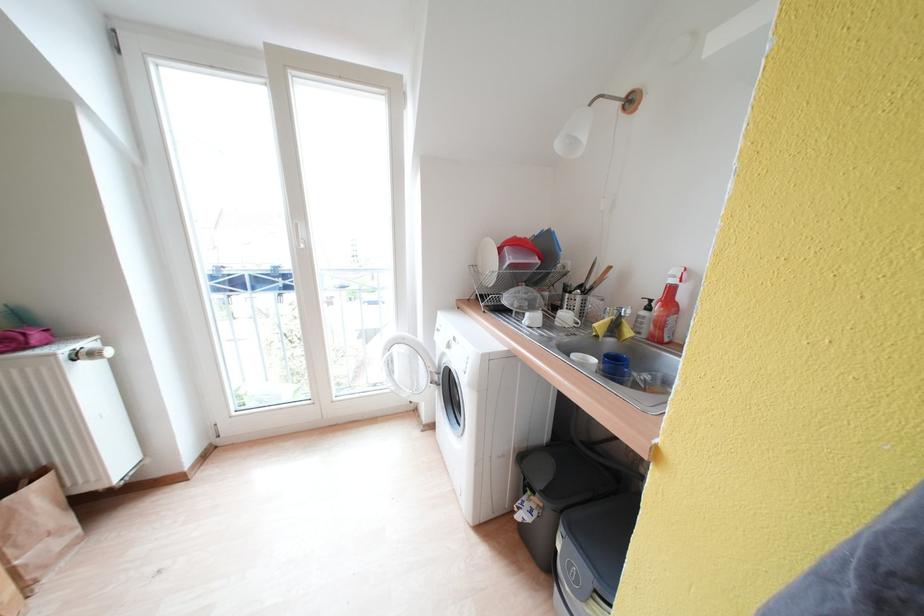
This screenshot has width=924, height=616. What are the coordinates of `knife handle` in the screenshot? It's located at (586, 278).